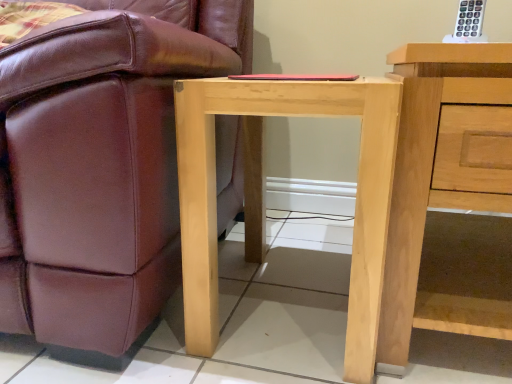
Question: Can we say natural wood nightstand at right lies outside natural wood table at center?

Choices:
 (A) no
 (B) yes

Answer: (B)

Question: From the image's perspective, is natural wood nightstand at right beneath natural wood table at center?

Choices:
 (A) yes
 (B) no

Answer: (B)

Question: From a real-world perspective, is natural wood nightstand at right located beneath natural wood table at center?

Choices:
 (A) yes
 (B) no

Answer: (B)

Question: Is natural wood table at center at the back of natural wood nightstand at right?

Choices:
 (A) no
 (B) yes

Answer: (A)

Question: Is natural wood nightstand at right smaller than natural wood table at center?

Choices:
 (A) no
 (B) yes

Answer: (A)

Question: Would you say natural wood table at center is inside or outside matte brown leather chair at lower left?

Choices:
 (A) inside
 (B) outside

Answer: (B)

Question: Relative to matte brown leather chair at lower left, is natural wood table at center in front or behind?

Choices:
 (A) front
 (B) behind

Answer: (B)

Question: Based on their sizes in the image, would you say natural wood table at center is bigger or smaller than matte brown leather chair at lower left?

Choices:
 (A) small
 (B) big

Answer: (A)

Question: From their relative heights in the image, would you say natural wood table at center is taller or shorter than matte brown leather chair at lower left?

Choices:
 (A) short
 (B) tall

Answer: (A)

Question: From the image's perspective, is natural wood table at center located above or below natural wood nightstand at right?

Choices:
 (A) above
 (B) below

Answer: (B)

Question: From a real-world perspective, is natural wood table at center positioned above or below natural wood nightstand at right?

Choices:
 (A) above
 (B) below

Answer: (B)

Question: From their relative heights in the image, would you say natural wood table at center is taller or shorter than natural wood nightstand at right?

Choices:
 (A) short
 (B) tall

Answer: (A)

Question: Is natural wood table at center to the left or to the right of natural wood nightstand at right in the image?

Choices:
 (A) right
 (B) left

Answer: (B)

Question: Looking at the image, does natural wood nightstand at right seem bigger or smaller compared to matte brown leather chair at lower left?

Choices:
 (A) small
 (B) big

Answer: (A)

Question: Is natural wood nightstand at right in front of or behind matte brown leather chair at lower left in the image?

Choices:
 (A) front
 (B) behind

Answer: (B)